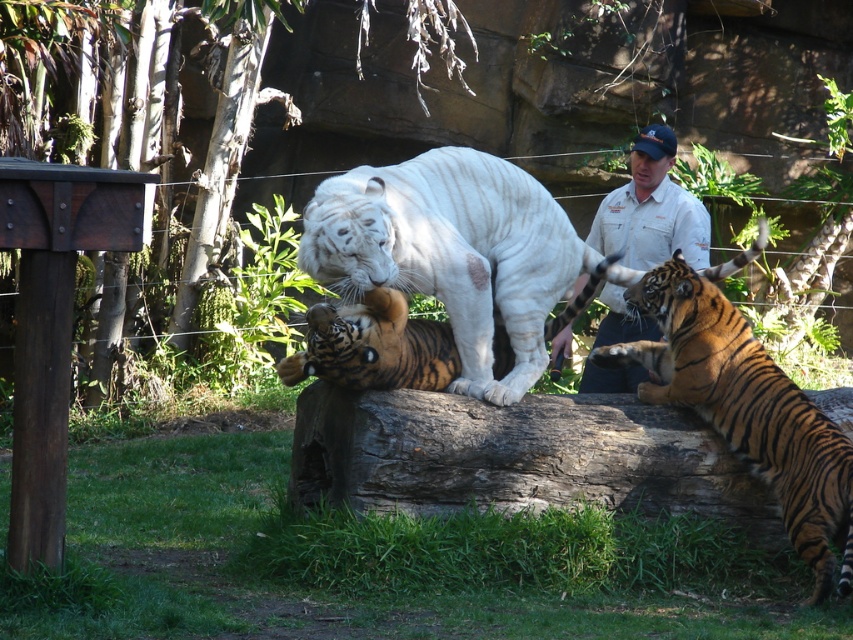
Question: Observing the image, what is the correct spatial positioning of orange striped tiger at center in reference to white shirt at upper center?

Choices:
 (A) right
 (B) left

Answer: (A)

Question: Which object is positioned closest to the white striped tiger at center?

Choices:
 (A) orange striped tiger at center
 (B) white shirt at upper center

Answer: (A)

Question: Can you confirm if orange striped tiger at center is positioned to the left of white shirt at upper center?

Choices:
 (A) no
 (B) yes

Answer: (A)

Question: Observing the image, what is the correct spatial positioning of white striped tiger at center in reference to orange striped tiger at center?

Choices:
 (A) below
 (B) above

Answer: (B)

Question: Which of these objects is positioned farthest from the orange striped tiger at center?

Choices:
 (A) white striped tiger at center
 (B) white shirt at upper center

Answer: (B)

Question: Estimate the real-world distances between objects in this image. Which object is closer to the white shirt at upper center?

Choices:
 (A) white striped tiger at center
 (B) orange striped tiger at center

Answer: (B)